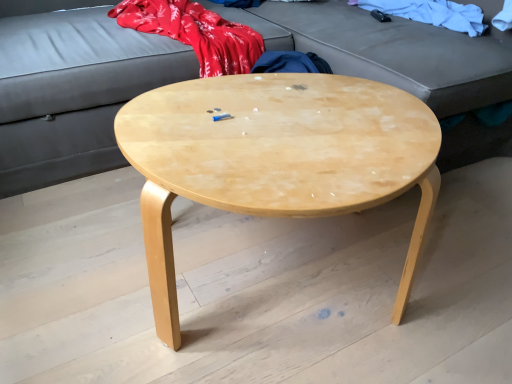
The image size is (512, 384). In order to click on vacant space in natural wood coffee table at center (from a real-world perspective) in this screenshot , I will do `click(296, 294)`.